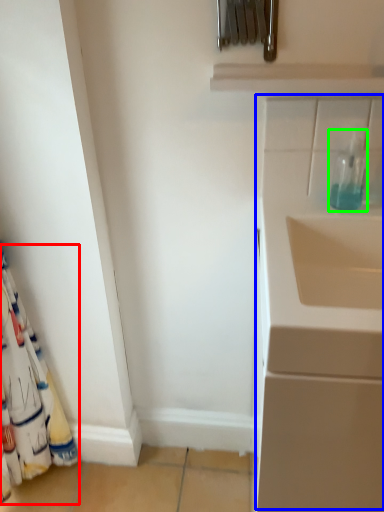
Question: Estimate the real-world distances between objects in this image. Which object is farther from curtain (highlighted by a red box), wide (highlighted by a blue box) or bottle (highlighted by a green box)?

Choices:
 (A) wide
 (B) bottle

Answer: (B)